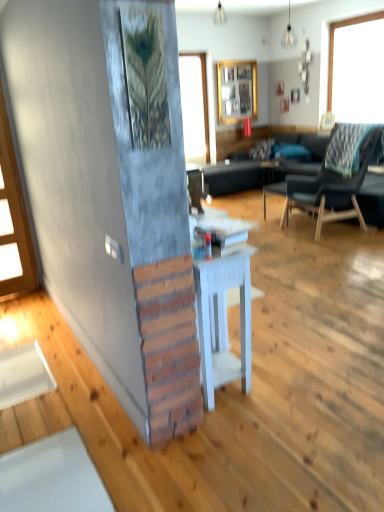
Locate an element on the screen. The width and height of the screenshot is (384, 512). wooden frame at upper center is located at coordinates (237, 91).

What do you see at coordinates (269, 168) in the screenshot?
I see `white wood side table at center` at bounding box center [269, 168].

How much space does matte glass bulb at upper center, marked as the 2th lamp in a left-to-right arrangement, occupy horizontally?

matte glass bulb at upper center, marked as the 2th lamp in a left-to-right arrangement, is 5.98 inches in width.

Measure the distance between point (289, 24) and camera.

21.81 feet.

The height and width of the screenshot is (512, 384). Describe the element at coordinates (262, 167) in the screenshot. I see `black fabric couch at center` at that location.

Where is `white painted wood table at center`? This screenshot has width=384, height=512. white painted wood table at center is located at coordinates (222, 318).

Describe the element at coordinates (327, 121) in the screenshot. The image size is (384, 512). I see `wooden picture frame at upper right` at that location.

Locate an element on the screen. wooden frame at upper center is located at coordinates (237, 91).

Is dark gray fabric chair at right positioned behind black fabric couch at center?

No, dark gray fabric chair at right is closer to the camera.

Between dark gray fabric chair at right and black fabric couch at center, which one has smaller size?

With smaller size is dark gray fabric chair at right.

Considering the sizes of dark gray fabric chair at right and black fabric couch at center in the image, is dark gray fabric chair at right taller or shorter than black fabric couch at center?

Clearly, dark gray fabric chair at right is taller compared to black fabric couch at center.

Is dark gray fabric chair at right positioned with its back to black fabric couch at center?

No.

Which object is thinner, matte white lampshade at upper center, which appears as the 1th lamp when viewed from the back, or dark gray fabric chair at right?

matte white lampshade at upper center, which appears as the 1th lamp when viewed from the back.

Is dark gray fabric chair at right inside matte white lampshade at upper center, placed as the second lamp when sorted from front to back?

No, matte white lampshade at upper center, placed as the second lamp when sorted from front to back, does not contain dark gray fabric chair at right.

Can you confirm if matte white lampshade at upper center, which is counted as the 1th lamp, starting from the left, is shorter than dark gray fabric chair at right?

Yes.

Does wooden frame at upper center appear on the left side of blue fabric pillow at center?

Indeed, wooden frame at upper center is positioned on the left side of blue fabric pillow at center.

Which is in front, point (229, 77) or point (281, 150)?

The point (281, 150) is closer.

Is wooden frame at upper center not inside blue fabric pillow at center?

Indeed, wooden frame at upper center is completely outside blue fabric pillow at center.

Does point (199, 157) appear closer or farther from the camera than point (231, 82)?

Point (199, 157) appears to be closer to the viewer than point (231, 82).

This screenshot has width=384, height=512. There is a clear glass window at upper center. In order to click on cabinetry above it (from a real-world perspective) in this screenshot , I will do `click(237, 91)`.

How distant is clear glass window at upper center from wooden frame at upper center?

They are 57.58 centimeters apart.

Between clear glass window at upper center and wooden frame at upper center, which one is positioned in front?

clear glass window at upper center.

Considering the sizes of objects clear glass window at upper center and white wood side table at center in the image provided, who is smaller, clear glass window at upper center or white wood side table at center?

Smaller between the two is white wood side table at center.

Considering the positions of objects clear glass window at upper center and white wood side table at center in the image provided, who is more to the left, clear glass window at upper center or white wood side table at center?

clear glass window at upper center.

From the picture: Considering the relative sizes of clear glass window at upper center and white wood side table at center in the image provided, is clear glass window at upper center shorter than white wood side table at center?

No, clear glass window at upper center is not shorter than white wood side table at center.

Measure the distance between clear glass window at upper center and white wood side table at center.

They are 4.46 feet apart.

There is a white wood side table at center. What are the coordinates of `pillow above it (from a real-world perspective)` in the screenshot? It's located at (290, 151).

Is white wood side table at center to the left of blue fabric pillow at center from the viewer's perspective?

Correct, you'll find white wood side table at center to the left of blue fabric pillow at center.

Is blue fabric pillow at center at the back of white wood side table at center?

That's not correct — white wood side table at center is not looking away from blue fabric pillow at center.

Is point (271, 174) farther from viewer compared to point (280, 148)?

No, (271, 174) is closer to viewer.

Is point (248, 294) positioned after point (329, 206)?

No.

In the image, is white painted wood table at center on the left side or the right side of dark gray fabric chair at right?

Based on their positions, white painted wood table at center is located to the left of dark gray fabric chair at right.

Is white painted wood table at center oriented towards dark gray fabric chair at right?

No, white painted wood table at center is not aimed at dark gray fabric chair at right.

This screenshot has width=384, height=512. Identify the location of table below the dark gray fabric chair at right (from a real-world perspective). (222, 318).

Where is `chair above the black fabric couch at center (from a real-world perspective)`? This screenshot has width=384, height=512. chair above the black fabric couch at center (from a real-world perspective) is located at coordinates (330, 187).

Find the location of a particular element. The image size is (384, 512). chair in front of the matte white lampshade at upper center, arranged as the second lamp when viewed from the right is located at coordinates (330, 187).

Based on their spatial positions, is matte white lampshade at upper center, the first lamp in the top-to-bottom sequence, or black fabric couch at center closer to wooden frame at upper center?

Among the two, matte white lampshade at upper center, the first lamp in the top-to-bottom sequence, is located nearer to wooden frame at upper center.

Estimate the real-world distances between objects in this image. Which object is further from blue fabric pillow at center, wooden picture frame at upper right or wooden frame at upper center?

Based on the image, wooden frame at upper center appears to be further to blue fabric pillow at center.

Estimate the real-world distances between objects in this image. Which object is closer to clear glass window at upper center, matte white lampshade at upper center, which is counted as the 1th lamp, starting from the left, or white wood side table at center?

matte white lampshade at upper center, which is counted as the 1th lamp, starting from the left, lies closer to clear glass window at upper center than the other object.

Which object lies further to the anchor point white wood side table at center, clear glass window at upper center or wooden frame at upper center?

Among the two, clear glass window at upper center is located further to white wood side table at center.

Based on their spatial positions, is clear glass window at upper center or white wood side table at center further from white painted wood table at center?

clear glass window at upper center is further to white painted wood table at center.

Estimate the real-world distances between objects in this image. Which object is further from clear glass window at upper center, black fabric couch at center or wooden frame at upper center?

Among the two, black fabric couch at center is located further to clear glass window at upper center.

Looking at the image, which one is located further to blue fabric pillow at center, clear glass window at upper center or wooden frame at upper center?

clear glass window at upper center is positioned further to the anchor blue fabric pillow at center.

Considering their positions, is wooden frame at upper center positioned further to blue fabric pillow at center than dark gray fabric chair at right?

dark gray fabric chair at right.

Find the location of `pillow positioned between dark gray fabric chair at right and clear glass window at upper center from near to far`. pillow positioned between dark gray fabric chair at right and clear glass window at upper center from near to far is located at coordinates (290, 151).

At what (x,y) coordinates should I click in order to perform the action: click on studio couch between dark gray fabric chair at right and white wood side table at center in the front-back direction. Please return your answer as a coordinate pair (x, y). Looking at the image, I should click on (262, 167).

At what (x,y) coordinates should I click in order to perform the action: click on cabinetry between black fabric couch at center and wooden picture frame at upper right in the horizontal direction. Please return your answer as a coordinate pair (x, y). The image size is (384, 512). Looking at the image, I should click on (237, 91).

You are a GUI agent. You are given a task and a screenshot of the screen. Output one action in this format:
    pyautogui.click(x=<x>, y=<y>)
    Task: Click on the studio couch between dark gray fabric chair at right and wooden frame at upper center along the z-axis
    Image resolution: width=384 pixels, height=512 pixels.
    Given the screenshot: What is the action you would take?
    pyautogui.click(x=262, y=167)